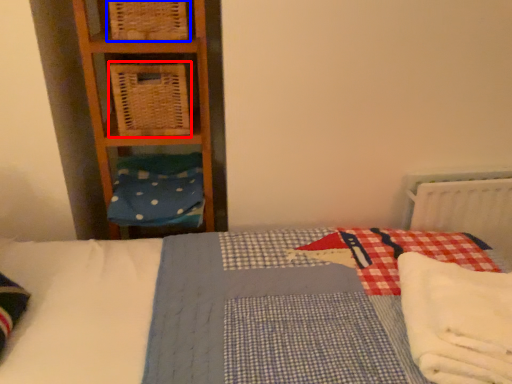
Question: Which object appears farthest to the camera in this image, crate (highlighted by a red box) or crate (highlighted by a blue box)?

Choices:
 (A) crate
 (B) crate

Answer: (A)